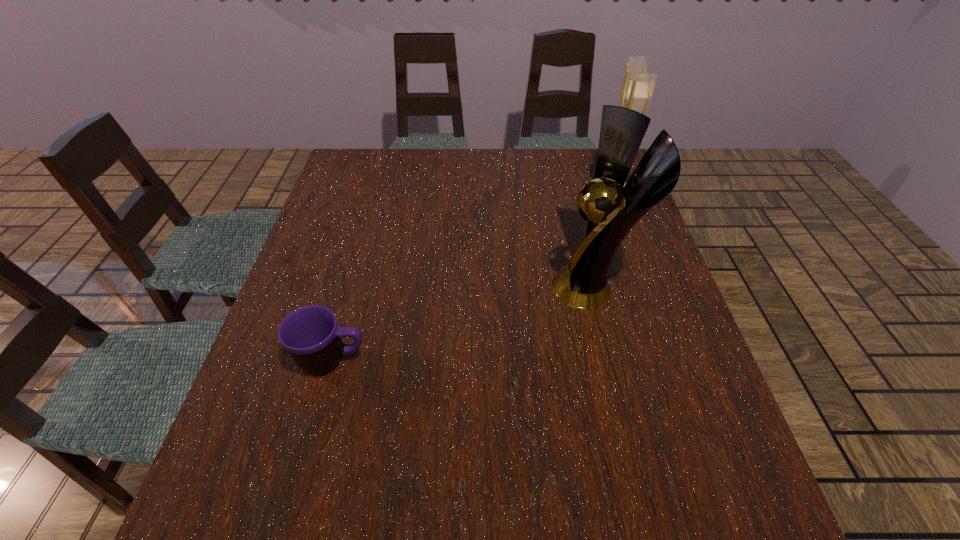
This screenshot has height=540, width=960. Find the location of `the nearer award`. the nearer award is located at coordinates (613, 209).

Find the location of a particular element. The image size is (960, 540). the farthest object is located at coordinates (637, 88).

The image size is (960, 540). I want to click on the shortest object, so click(x=311, y=335).

Where is `mug`? mug is located at coordinates [x=311, y=335].

Where is `free space located at the front of the second farthest object, where the globe is visible`? The height and width of the screenshot is (540, 960). free space located at the front of the second farthest object, where the globe is visible is located at coordinates (389, 287).

Where is `blank area located at the front of the second farthest object, where the globe is visible`? blank area located at the front of the second farthest object, where the globe is visible is located at coordinates (503, 287).

Image resolution: width=960 pixels, height=540 pixels. Identify the location of free region located at the front of the second farthest object, where the globe is visible. (528, 287).

Locate an element on the screen. blank space located on the front-facing side of the farthest object is located at coordinates (511, 193).

I want to click on blank space located 0.350m on the front-facing side of the farthest object, so click(482, 193).

Where is `free spot located on the front-facing side of the farthest object`? free spot located on the front-facing side of the farthest object is located at coordinates (560, 193).